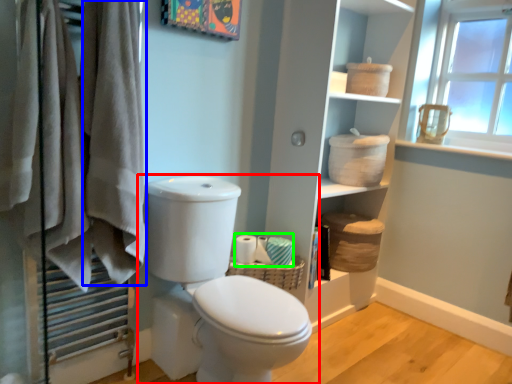
Question: Which object is the farthest from toilet (highlighted by a red box)? Choose among these: bath towel (highlighted by a blue box) or toilet paper (highlighted by a green box).

Choices:
 (A) bath towel
 (B) toilet paper

Answer: (B)